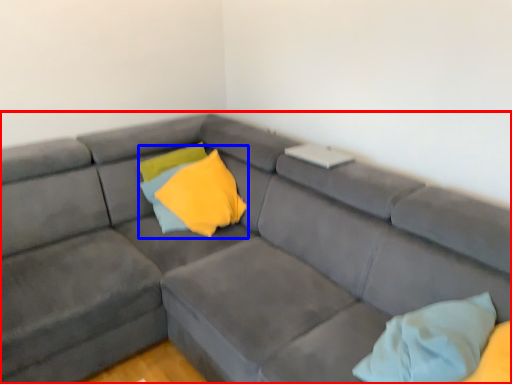
Question: Which object appears closest to the camera in this image, studio couch (highlighted by a red box) or pillow (highlighted by a blue box)?

Choices:
 (A) studio couch
 (B) pillow

Answer: (A)